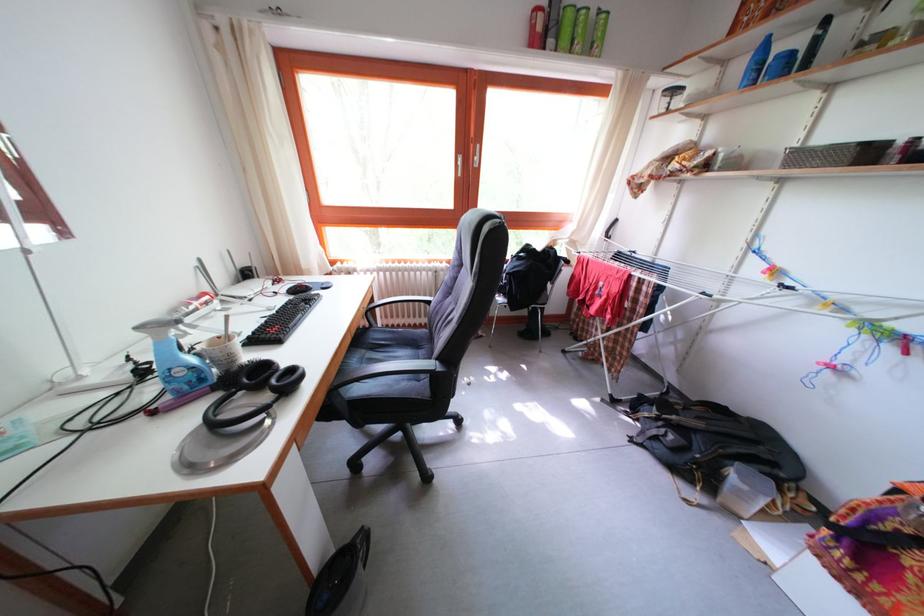
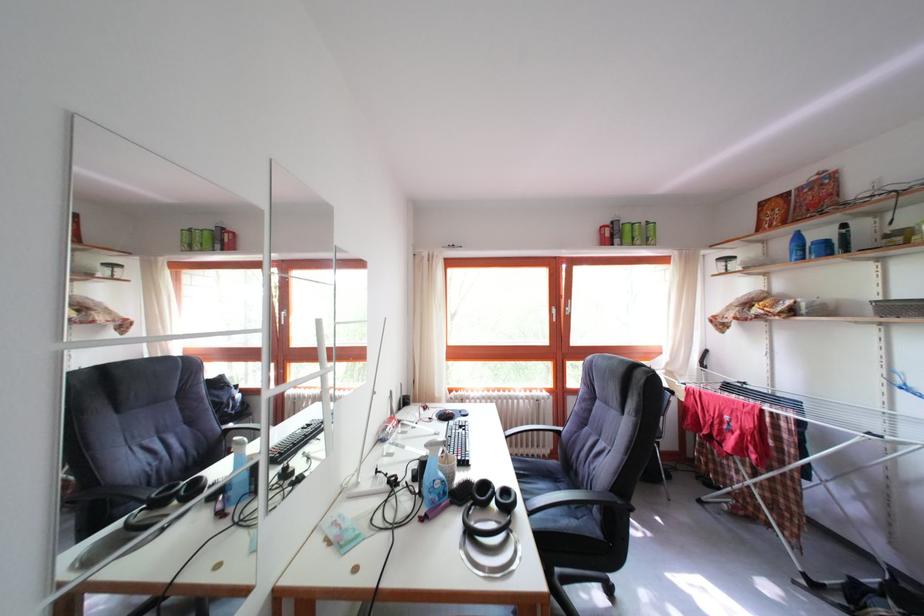
What movement of the cameraman would produce the second image?

The cameraman walked toward left, backward.